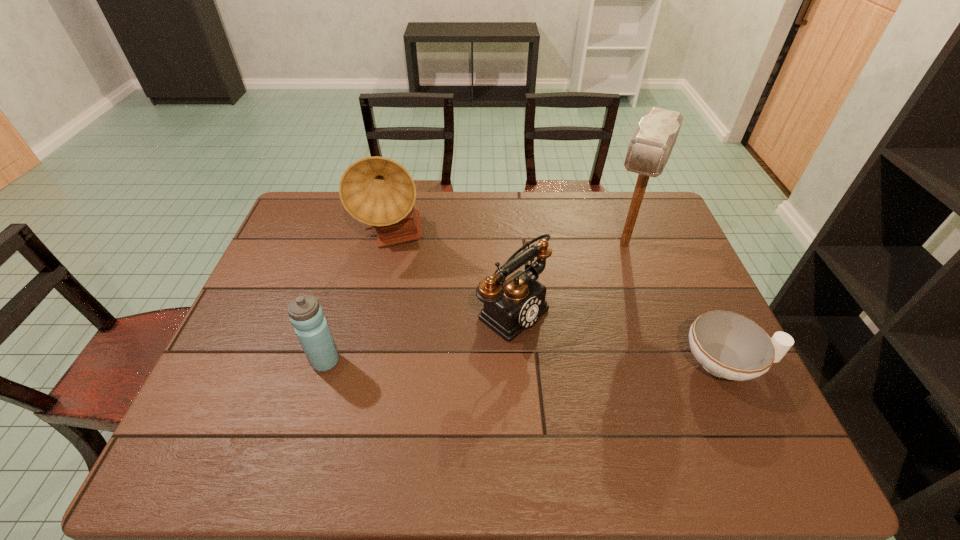
Find the location of a particular element. The height and width of the screenshot is (540, 960). object located at the far right corner is located at coordinates (650, 147).

Locate an element on the screen. The height and width of the screenshot is (540, 960). object located in the near right corner section of the desktop is located at coordinates (728, 345).

In the image, there is a desktop. At what (x,y) coordinates should I click in order to perform the action: click on vacant region at the far edge. Please return your answer as a coordinate pair (x, y). Looking at the image, I should click on (603, 215).

The width and height of the screenshot is (960, 540). Find the location of `vacant space at the near edge`. vacant space at the near edge is located at coordinates (461, 399).

At what (x,y) coordinates should I click in order to perform the action: click on blank area at the left edge. Please return your answer as a coordinate pair (x, y). This screenshot has height=540, width=960. Looking at the image, I should click on (229, 370).

You are a GUI agent. You are given a task and a screenshot of the screen. Output one action in this format:
    pyautogui.click(x=<x>, y=<y>)
    Task: Click on the vacant space at the right edge of the desktop
    The width and height of the screenshot is (960, 540).
    Given the screenshot: What is the action you would take?
    pyautogui.click(x=685, y=271)

Where is `vacant space in between the telephone and the phonograph record`? The width and height of the screenshot is (960, 540). vacant space in between the telephone and the phonograph record is located at coordinates (454, 274).

Where is `free space between the mallet and the chinaware`? This screenshot has height=540, width=960. free space between the mallet and the chinaware is located at coordinates (676, 303).

Where is `vacant space that's between the shortest object and the third object from right to left`? vacant space that's between the shortest object and the third object from right to left is located at coordinates (620, 336).

Where is `free space between the water bottle and the mallet`? The width and height of the screenshot is (960, 540). free space between the water bottle and the mallet is located at coordinates (475, 302).